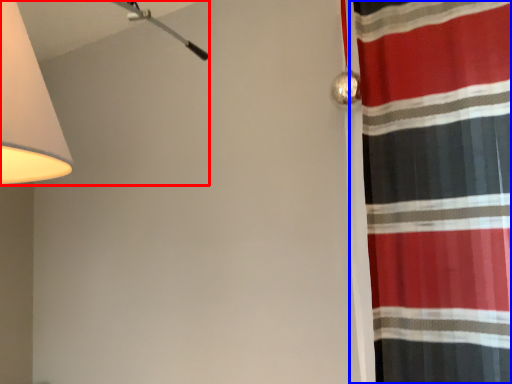
Question: Which of the following is the farthest to the observer, lamp (highlighted by a red box) or curtain (highlighted by a blue box)?

Choices:
 (A) lamp
 (B) curtain

Answer: (B)